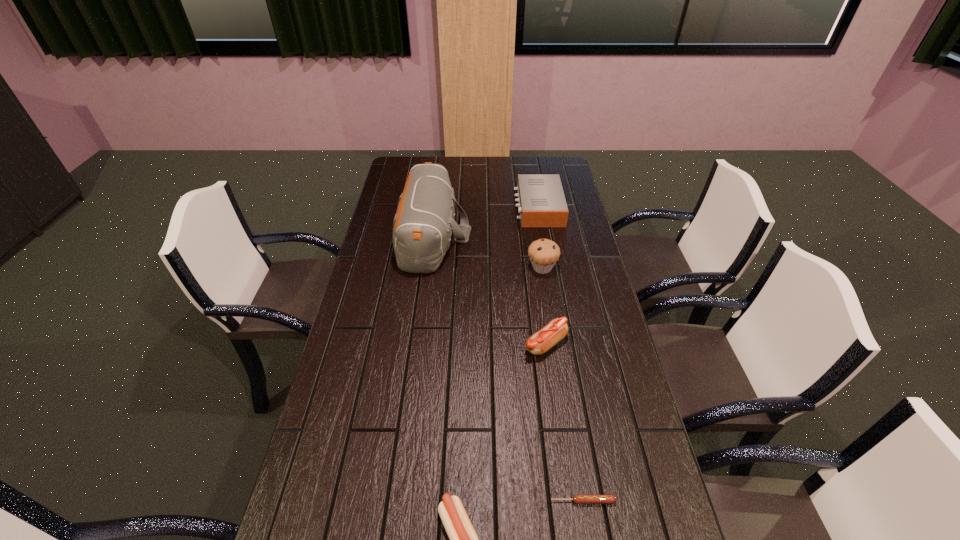
Where is `the tallest object`? the tallest object is located at coordinates (423, 224).

This screenshot has width=960, height=540. In order to click on the fifth shortest object in this screenshot , I will do `click(543, 253)`.

The width and height of the screenshot is (960, 540). In order to click on radio receiver in this screenshot , I will do `click(542, 203)`.

You are a GUI agent. You are given a task and a screenshot of the screen. Output one action in this format:
    pyautogui.click(x=<x>, y=<y>)
    Task: Click on the tallest sausage
    This screenshot has width=960, height=540.
    Given the screenshot: What is the action you would take?
    pyautogui.click(x=555, y=330)

At what (x,y) coordinates should I click in order to perform the action: click on the third nearest object. Please return your answer as a coordinate pair (x, y). Looking at the image, I should click on (555, 330).

Image resolution: width=960 pixels, height=540 pixels. I want to click on the shortest object, so click(x=578, y=499).

The width and height of the screenshot is (960, 540). In order to click on vacant space located 0.250m on the front of the tallest object in this screenshot , I will do `click(420, 333)`.

At what (x,y) coordinates should I click in order to perform the action: click on free space located 0.090m on the left of the second tallest object. Please return your answer as a coordinate pair (x, y). Image resolution: width=960 pixels, height=540 pixels. Looking at the image, I should click on (501, 268).

Identify the location of vacant area located on the control panel of the radio receiver. (423, 206).

Find the location of a particular element. This screenshot has width=960, height=540. vacant space located 0.060m on the control panel of the radio receiver is located at coordinates (501, 206).